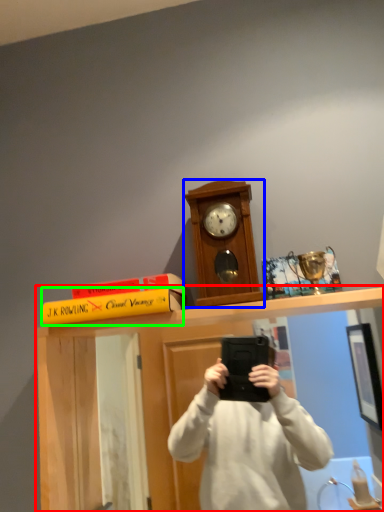
Question: Based on their relative distances, which object is nearer to vanity (highlighted by a red box)? Choose from clock (highlighted by a blue box) and book (highlighted by a green box).

Choices:
 (A) clock
 (B) book

Answer: (B)